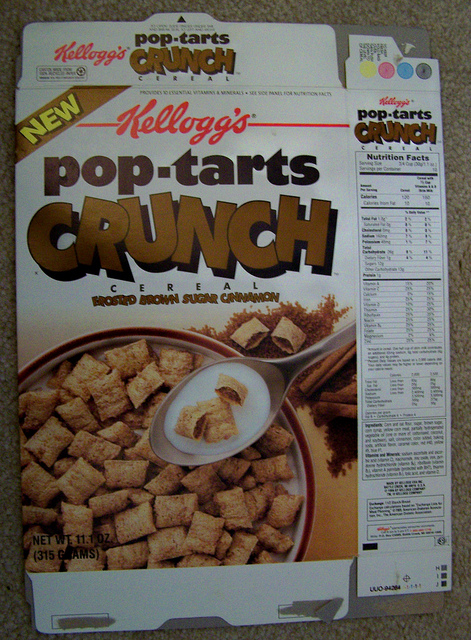
The width and height of the screenshot is (471, 640). I want to click on bowl, so click(x=311, y=496).